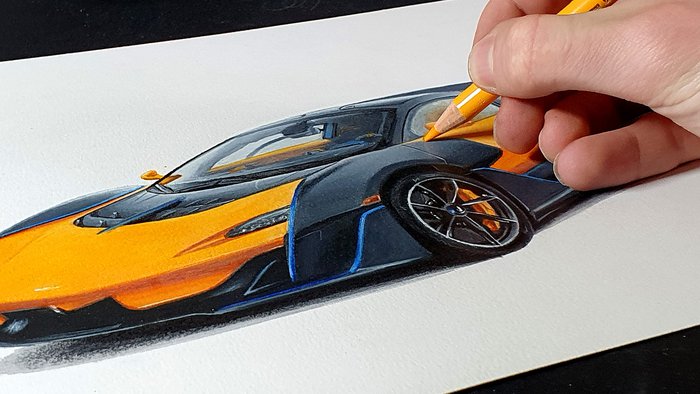
At what (x,y) coordinates should I click in order to perform the action: click on mirror. Please return your answer as a coordinate pair (x, y). The image size is (700, 394). Looking at the image, I should click on (152, 174).